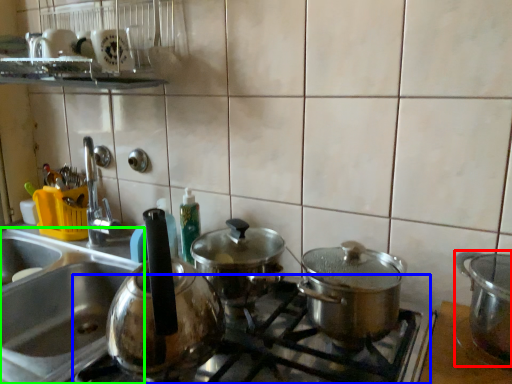
Question: Estimate the real-world distances between objects in this image. Which object is farther from kitchen appliance (highlighted by a red box), gas stove (highlighted by a blue box) or sink (highlighted by a green box)?

Choices:
 (A) gas stove
 (B) sink

Answer: (B)